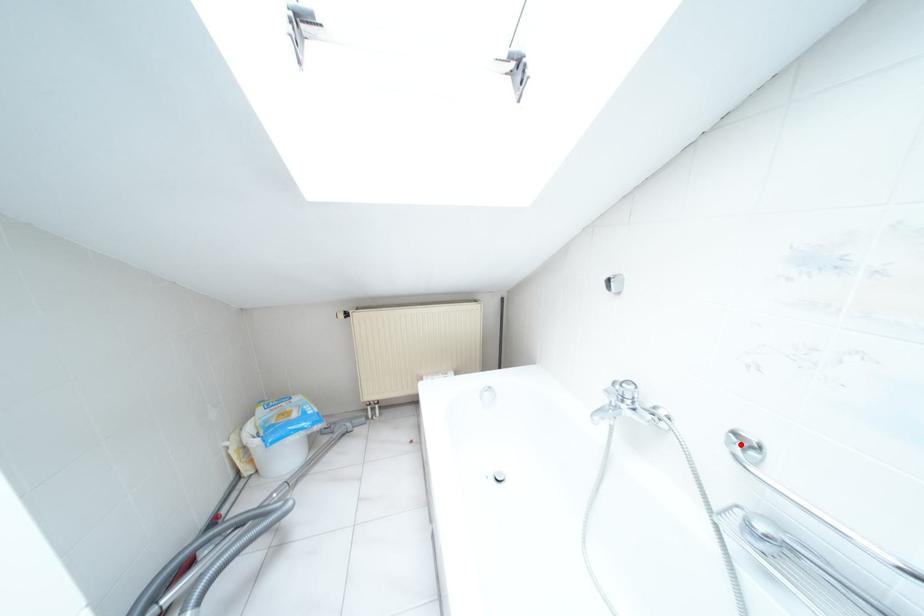
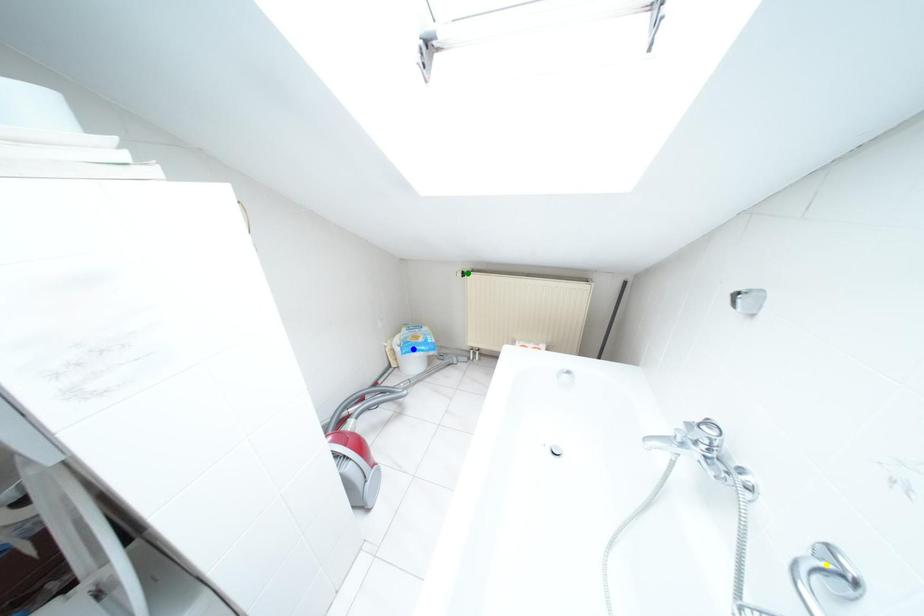
Question: I am providing you with two images of the same scene from different viewpoints. A red point is marked on the first image. You are given multiple points on the second image. Which point in image 2 represents the same 3d spot as the red point in image 1?

Choices:
 (A) blue point
 (B) yellow point
 (C) green point

Answer: (B)